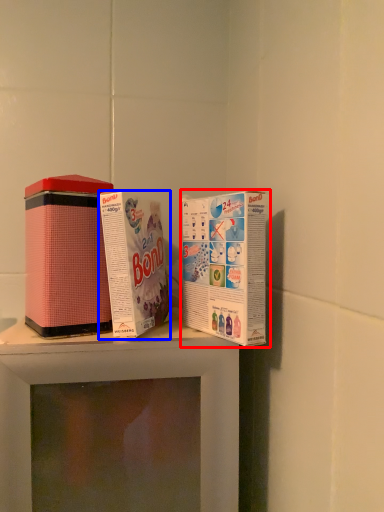
Question: Which point is closer to the camera, product (highlighted by a red box) or product (highlighted by a blue box)?

Choices:
 (A) product
 (B) product

Answer: (A)